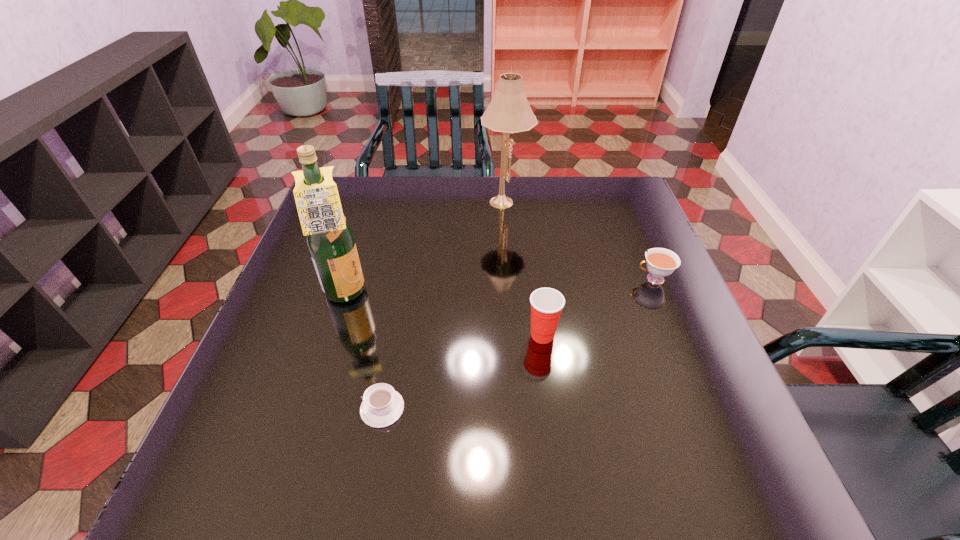
Locate an element on the screen. free space at the far edge is located at coordinates (423, 185).

In the image, there is a desktop. Where is `vacant space at the left edge`? This screenshot has width=960, height=540. vacant space at the left edge is located at coordinates (276, 387).

You are a GUI agent. You are given a task and a screenshot of the screen. Output one action in this format:
    pyautogui.click(x=<x>, y=<y>)
    Task: Click on the vacant space at the right edge of the desktop
    This screenshot has width=960, height=540.
    Given the screenshot: What is the action you would take?
    [672, 285]

Find the location of a particular element. The width and height of the screenshot is (960, 540). vacant space at the far right corner of the desktop is located at coordinates (585, 188).

I want to click on free space between the shorter teacup and the farthest object, so point(444,305).

Where is `vacant space that is in between the leftmost object and the farthest object`? The image size is (960, 540). vacant space that is in between the leftmost object and the farthest object is located at coordinates (425, 248).

The image size is (960, 540). In order to click on free spot between the nearer teacup and the taller teacup in this screenshot , I will do `click(517, 343)`.

The width and height of the screenshot is (960, 540). I want to click on unoccupied area between the farthest object and the leftmost object, so click(x=425, y=248).

Find the location of a particular element. free space that is in between the leftmost object and the third shortest object is located at coordinates (444, 315).

Locate an element on the screen. free point between the right teacup and the farthest object is located at coordinates (579, 240).